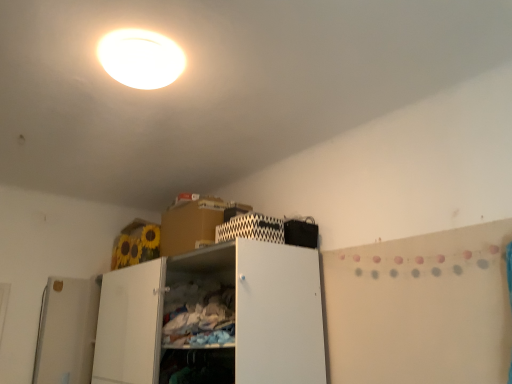
What do you see at coordinates (215, 316) in the screenshot? The image size is (512, 384). I see `white matte cabinet at center` at bounding box center [215, 316].

Locate an element on the screen. The height and width of the screenshot is (384, 512). white matte cabinet at center is located at coordinates (215, 316).

Find the location of a particular element. The height and width of the screenshot is (384, 512). white glossy ceiling light at upper center is located at coordinates (141, 58).

Locate an element on the screen. white matte cabinet at center is located at coordinates (215, 316).

From a real-world perspective, relative to white matte cabinet at center, is white glossy ceiling light at upper center vertically above or below?

Clearly, from a real-world perspective, white glossy ceiling light at upper center is above white matte cabinet at center.

Consider the image. From the image's perspective, between white glossy ceiling light at upper center and white matte cabinet at center, which one is located above?

white glossy ceiling light at upper center.

Is white glossy ceiling light at upper center facing towards white matte cabinet at center?

No, white glossy ceiling light at upper center is not facing towards white matte cabinet at center.

Is white glossy ceiling light at upper center bigger or smaller than white matte cabinet at center?

In the image, white glossy ceiling light at upper center appears to be smaller than white matte cabinet at center.

Where is `cabinet lying behind the white matte cabinet at center`? cabinet lying behind the white matte cabinet at center is located at coordinates (251, 228).

Considering the sizes of objects black zigzag-patterned cabinet at upper center and white matte cabinet at center in the image provided, who is wider, black zigzag-patterned cabinet at upper center or white matte cabinet at center?

Wider between the two is white matte cabinet at center.

From the image's perspective, between black zigzag-patterned cabinet at upper center and white matte cabinet at center, which one is located above?

black zigzag-patterned cabinet at upper center.

Is white matte cabinet at center further to camera compared to black zigzag-patterned cabinet at upper center?

No, it is in front of black zigzag-patterned cabinet at upper center.

Considering the relative sizes of white matte cabinet at center and black zigzag-patterned cabinet at upper center in the image provided, is white matte cabinet at center smaller than black zigzag-patterned cabinet at upper center?

No.

In the scene shown: From the image's perspective, is white matte cabinet at center located beneath black zigzag-patterned cabinet at upper center?

Yes.

Is black zigzag-patterned cabinet at upper center inside white matte cabinet at center?

That's incorrect, black zigzag-patterned cabinet at upper center is not inside white matte cabinet at center.

The width and height of the screenshot is (512, 384). What are the coordinates of `cabinetry below the white glossy ceiling light at upper center (from a real-world perspective)` in the screenshot? It's located at (215, 316).

Is there a large distance between white matte cabinet at center and white glossy ceiling light at upper center?

white matte cabinet at center is positioned a significant distance from white glossy ceiling light at upper center.

Can you tell me how much white matte cabinet at center and white glossy ceiling light at upper center differ in facing direction?

89.5 degrees.

From a real-world perspective, is white matte cabinet at center physically above white glossy ceiling light at upper center?

No.

From a real-world perspective, relative to black zigzag-patterned cabinet at upper center, is white glossy ceiling light at upper center vertically above or below?

Clearly, from a real-world perspective, white glossy ceiling light at upper center is above black zigzag-patterned cabinet at upper center.

Is white glossy ceiling light at upper center with black zigzag-patterned cabinet at upper center?

No, white glossy ceiling light at upper center is not touching black zigzag-patterned cabinet at upper center.

Which of these two, white glossy ceiling light at upper center or black zigzag-patterned cabinet at upper center, is bigger?

white glossy ceiling light at upper center.

Is white glossy ceiling light at upper center thinner than black zigzag-patterned cabinet at upper center?

In fact, white glossy ceiling light at upper center might be wider than black zigzag-patterned cabinet at upper center.

Is white glossy ceiling light at upper center completely or partially inside black zigzag-patterned cabinet at upper center?

No, white glossy ceiling light at upper center is not a part of black zigzag-patterned cabinet at upper center.

From the image's perspective, which one is positioned lower, black zigzag-patterned cabinet at upper center or white glossy ceiling light at upper center?

black zigzag-patterned cabinet at upper center, from the image's perspective.

Considering the sizes of objects black zigzag-patterned cabinet at upper center and white glossy ceiling light at upper center in the image provided, who is taller, black zigzag-patterned cabinet at upper center or white glossy ceiling light at upper center?

black zigzag-patterned cabinet at upper center.

Is black zigzag-patterned cabinet at upper center directly adjacent to white glossy ceiling light at upper center?

No.

You are a GUI agent. You are given a task and a screenshot of the screen. Output one action in this format:
    pyautogui.click(x=<x>, y=<y>)
    Task: Click on the cabinetry behind the white glossy ceiling light at upper center
    The width and height of the screenshot is (512, 384).
    Given the screenshot: What is the action you would take?
    pyautogui.click(x=215, y=316)

Image resolution: width=512 pixels, height=384 pixels. What are the coordinates of `cabinetry that appears in front of the black zigzag-patterned cabinet at upper center` in the screenshot? It's located at tap(215, 316).

From the picture: Based on their spatial positions, is white matte cabinet at center or black zigzag-patterned cabinet at upper center closer to white glossy ceiling light at upper center?

black zigzag-patterned cabinet at upper center is closer to white glossy ceiling light at upper center.

Looking at the image, which one is located closer to black zigzag-patterned cabinet at upper center, white matte cabinet at center or white glossy ceiling light at upper center?

white matte cabinet at center is closer to black zigzag-patterned cabinet at upper center.

Looking at the image, which one is located further to white matte cabinet at center, white glossy ceiling light at upper center or black zigzag-patterned cabinet at upper center?

white glossy ceiling light at upper center is positioned further to the anchor white matte cabinet at center.

Looking at the image, which one is located further to black zigzag-patterned cabinet at upper center, white glossy ceiling light at upper center or white matte cabinet at center?

Based on the image, white glossy ceiling light at upper center appears to be further to black zigzag-patterned cabinet at upper center.

When comparing their distances from white matte cabinet at center, does black zigzag-patterned cabinet at upper center or white glossy ceiling light at upper center seem further?

Based on the image, white glossy ceiling light at upper center appears to be further to white matte cabinet at center.

Considering their positions, is black zigzag-patterned cabinet at upper center positioned further to white glossy ceiling light at upper center than white matte cabinet at center?

white matte cabinet at center is positioned further to the anchor white glossy ceiling light at upper center.

The image size is (512, 384). What are the coordinates of `cabinet between white glossy ceiling light at upper center and white matte cabinet at center in the up-down direction` in the screenshot? It's located at (251, 228).